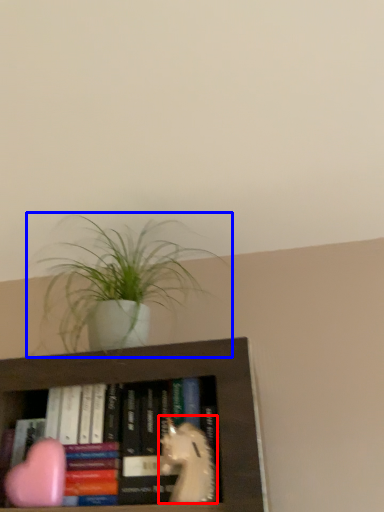
Question: Which point is closer to the camera, animal (highlighted by a red box) or houseplant (highlighted by a blue box)?

Choices:
 (A) animal
 (B) houseplant

Answer: (A)